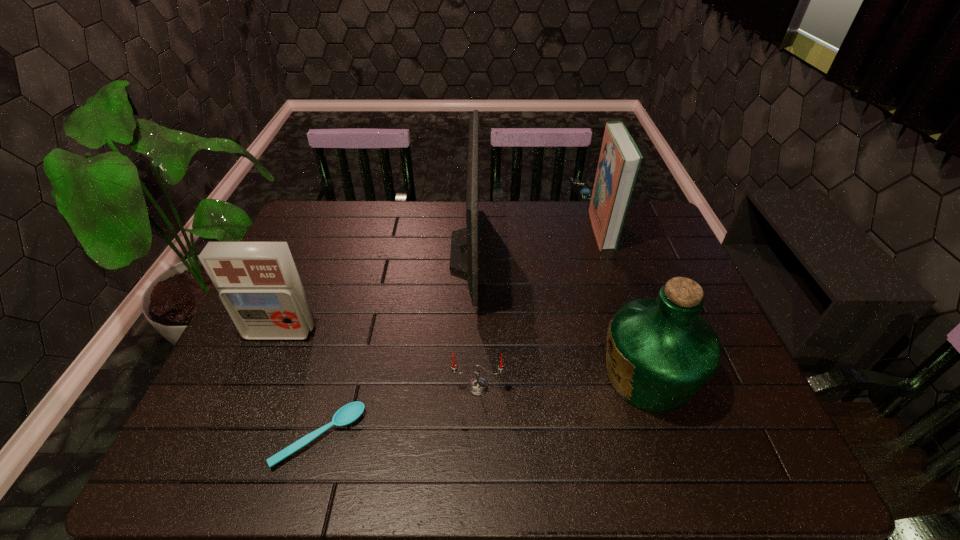
Identify the location of free point located on the cover of the hardback book. (541, 229).

The height and width of the screenshot is (540, 960). What are the coordinates of `vacant space located on the label side of the liquor` in the screenshot? It's located at (568, 376).

Where is `vacant space positioned 0.270m on the label side of the liquor`? vacant space positioned 0.270m on the label side of the liquor is located at coordinates (484, 376).

Image resolution: width=960 pixels, height=540 pixels. I want to click on blank space located 0.180m on the label side of the liquor, so click(x=522, y=376).

In order to click on vacant space located on the front-facing side of the leftmost object in this screenshot , I will do `click(252, 401)`.

Where is `blank space located on the front-facing side of the second shortest object`? This screenshot has height=540, width=960. blank space located on the front-facing side of the second shortest object is located at coordinates (477, 433).

This screenshot has height=540, width=960. I want to click on blank space located 0.240m on the right of the second object from left to right, so click(474, 437).

The image size is (960, 540). I want to click on monitor located in the far edge section of the desktop, so 468,246.

I want to click on hardback book that is at the far edge, so click(620, 159).

Locate an element on the screen. object that is positioned at the near edge is located at coordinates (349, 413).